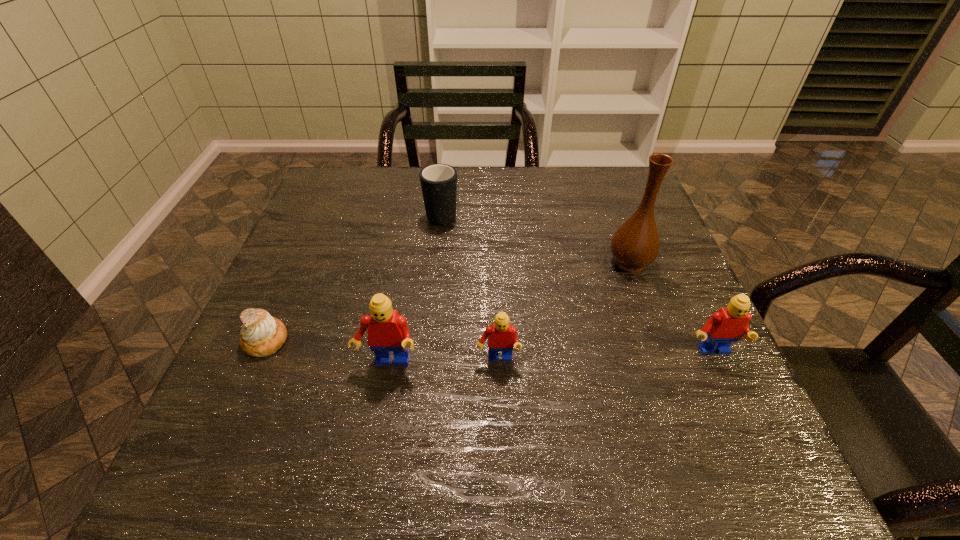
To make them evenly spaced by inserting another Lego among them, please locate a vacant spot for this new Lego. Please provide its 2D coordinates. Your answer should be formatted as a tuple, i.e. [(x, y)], where the tuple contains the x and y coordinates of a point satisfying the conditions above.

[(606, 356)]